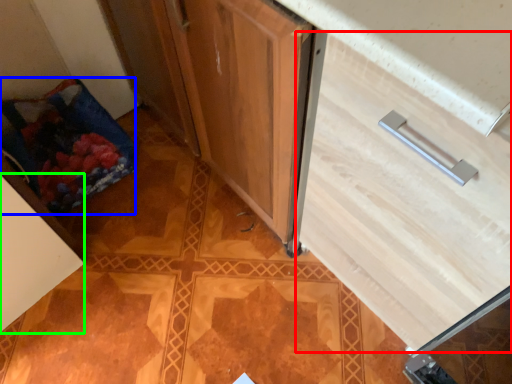
Question: Estimate the real-world distances between objects in this image. Which object is closer to drawer (highlighted by a red box), material (highlighted by a blue box) or cabinetry (highlighted by a green box)?

Choices:
 (A) material
 (B) cabinetry

Answer: (B)